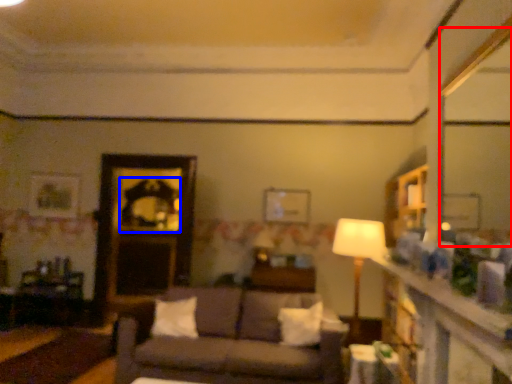
Question: Which object appears closest to the camera in this image, mirror (highlighted by a red box) or mirror (highlighted by a blue box)?

Choices:
 (A) mirror
 (B) mirror

Answer: (A)